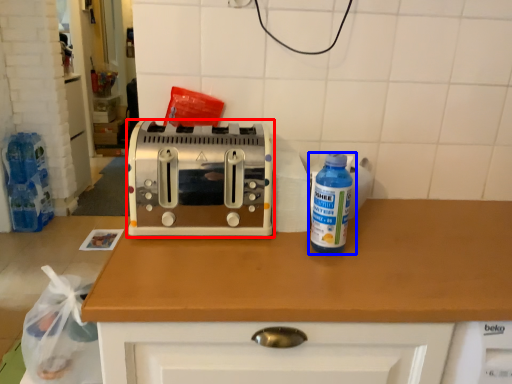
Question: Which object is closer to the camera taking this photo, toaster (highlighted by a red box) or bottle (highlighted by a blue box)?

Choices:
 (A) toaster
 (B) bottle

Answer: (B)